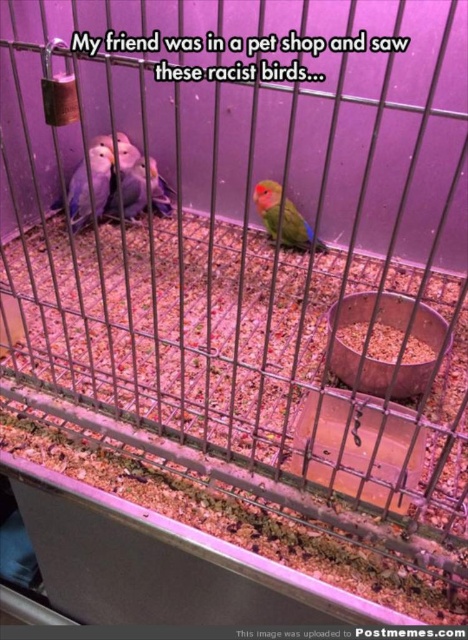
You are a visitor at a pet store and see this birdcage with several birds. There is a point marked at coordinates (101, 173). Which bird is located at this point?

The point at coordinates (101, 173) indicates the location of the matte blue bird at center left.